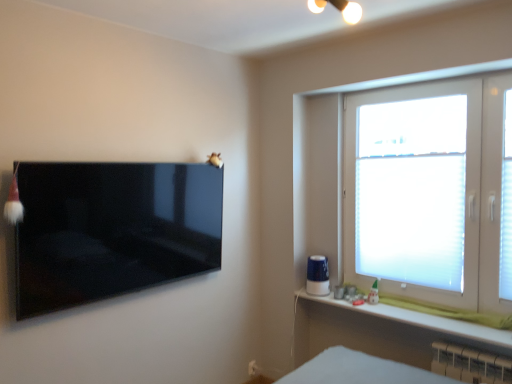
You are a GUI agent. You are given a task and a screenshot of the screen. Output one action in this format:
    pyautogui.click(x=<x>, y=<y>)
    Task: Click on the blank space situated above white matte window sill at lower right (from a real-world perspective)
    This screenshot has width=512, height=384.
    Given the screenshot: What is the action you would take?
    pyautogui.click(x=404, y=310)